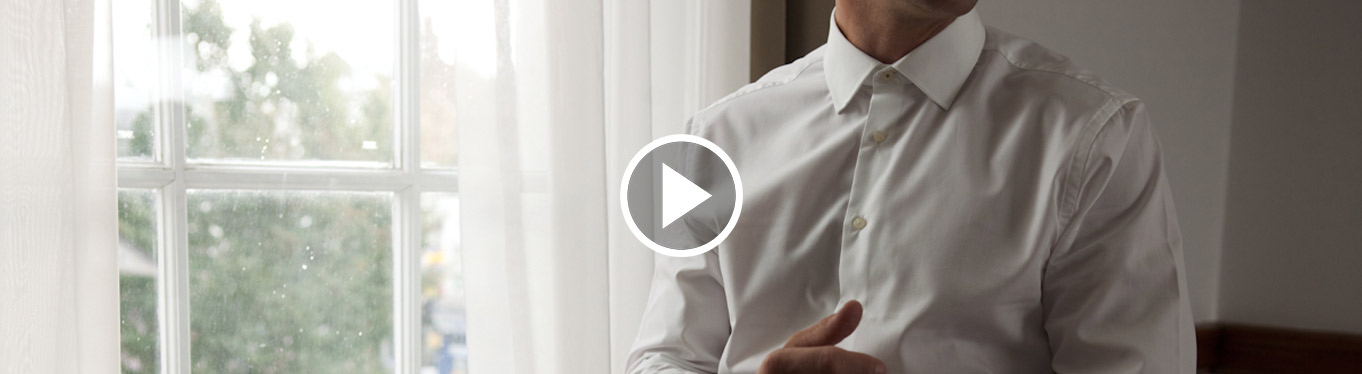
Where is `wall trim`? Image resolution: width=1362 pixels, height=374 pixels. wall trim is located at coordinates (1263, 359).